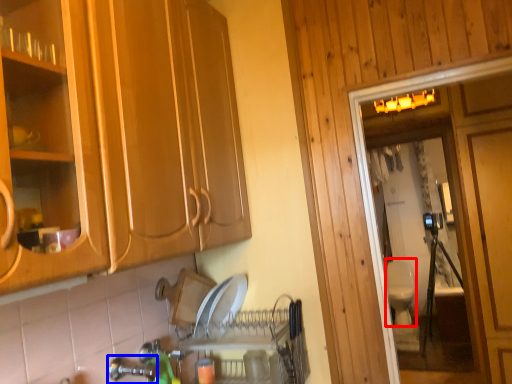
Question: Which of the following is the farthest to the observer, toilet bowl (highlighted by a red box) or faucet (highlighted by a blue box)?

Choices:
 (A) toilet bowl
 (B) faucet

Answer: (A)